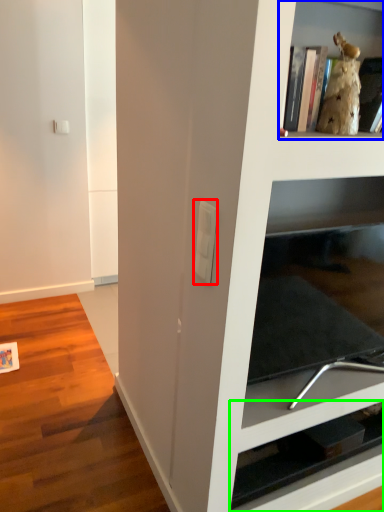
Question: Which object is the closest to the light switch (highlighted by a red box)? Choose among these: shelf (highlighted by a blue box) or shelf (highlighted by a green box).

Choices:
 (A) shelf
 (B) shelf

Answer: (A)